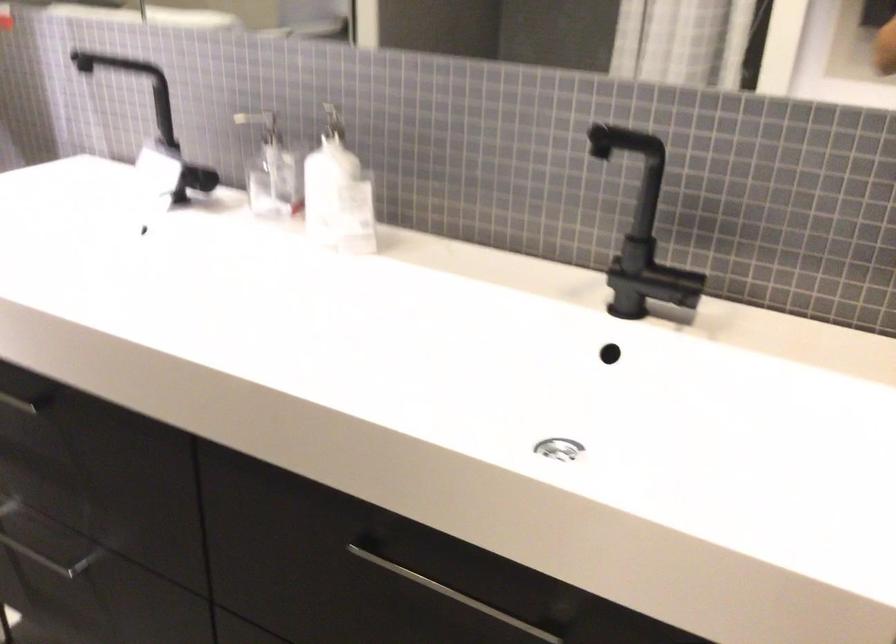
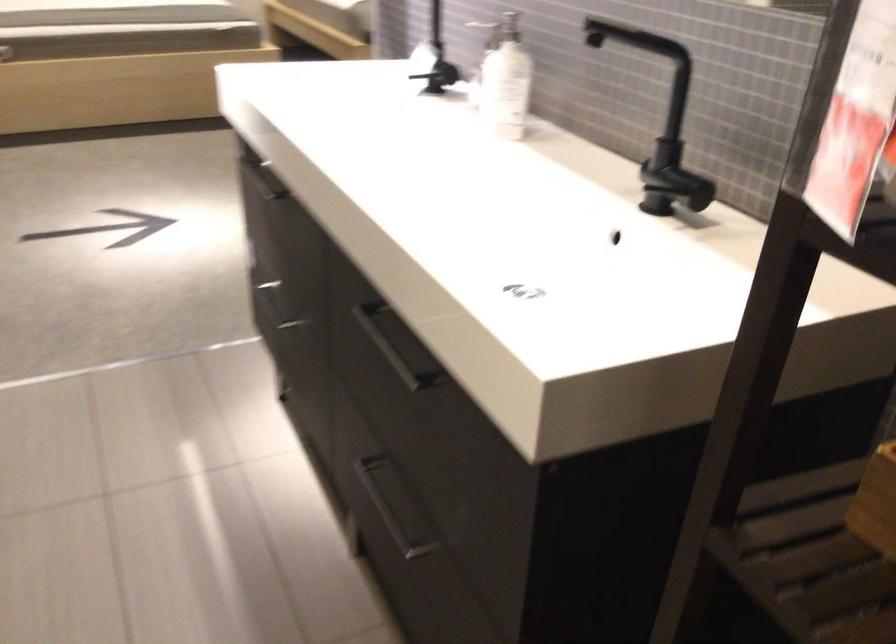
Question: The images are taken continuously from a first-person perspective. In which direction is your viewpoint rotating?

Choices:
 (A) Left
 (B) Right
 (C) Up
 (D) Down

Answer: (A)